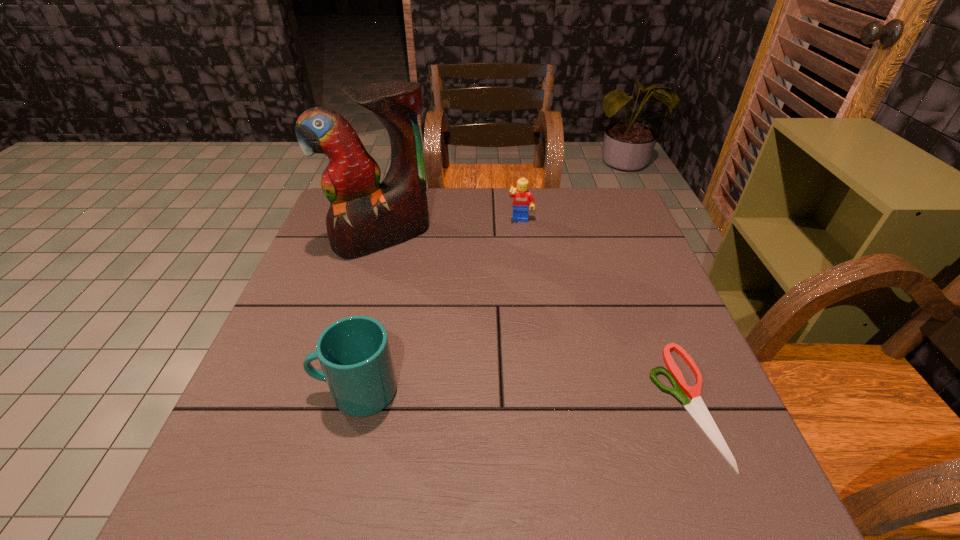
Identify the location of free spot that satisfies the following two spatial constraints: 1. on the front side of the cup; 2. on the handle side of the parrot. (339, 392).